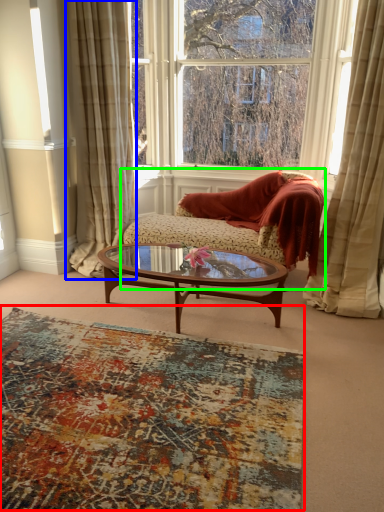
Question: Based on their relative distances, which object is nearer to plain (highlighted by a red box)? Choose from curtain (highlighted by a blue box) and studio couch (highlighted by a green box).

Choices:
 (A) curtain
 (B) studio couch

Answer: (B)